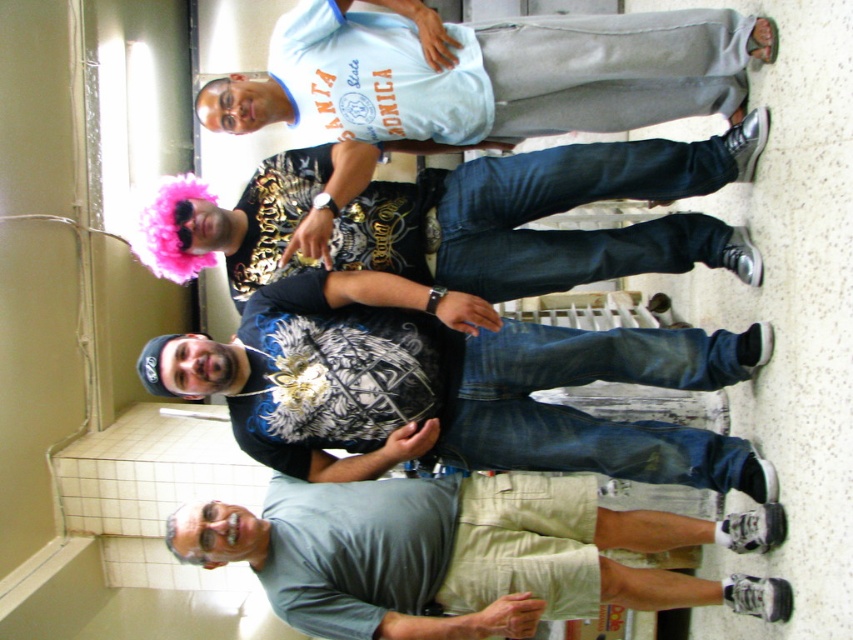
Is the point at coordinates (451, 387) located on the black matte t shirt at center?

Yes, the point at coordinates (451, 387) is located on the black matte t shirt at center.